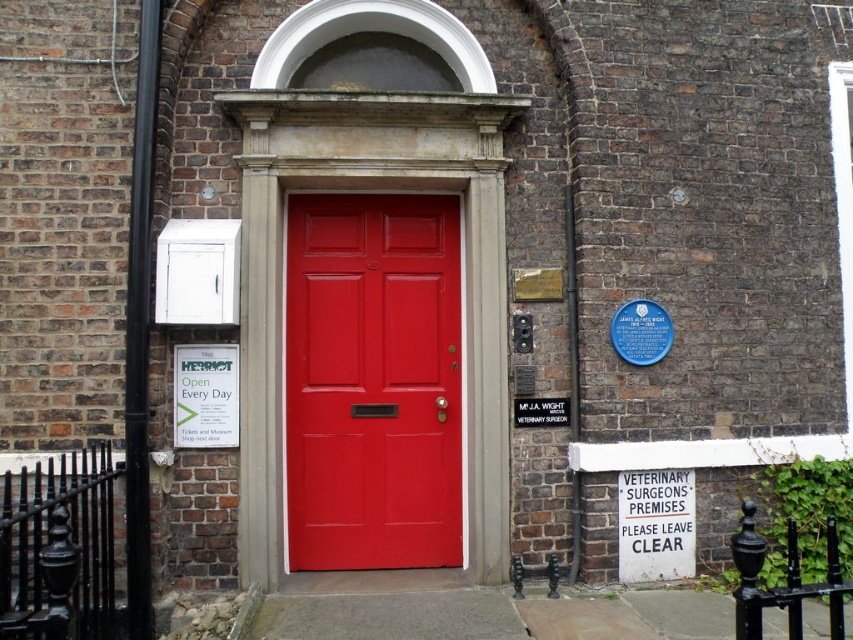
From the picture: You are a delivery person trying to deliver a package to Herriot. You see the matte red door at center and the white paper sign at center. Which object should you interact with to deliver the package?

You should interact with the matte red door at center because it is larger in size than the white paper sign at center, indicating it is the entrance for deliveries.

You are a delivery person approaching the entrance of Herriot. You need to read the sign to confirm the address. Can you see the white paper sign at center from your current position in front of the matte red door at center?

The white paper sign at center is behind matte red door at center, so you cannot see it from your current position in front of the matte red door at center.

You are a delivery person trying to deliver a package to the building. The instructions say to place it on the object that is taller between the matte red door at center and the white paper sign at center. Which object should you place the package on?

The matte red door at center is taller than the white paper sign at center, so you should place the package on the matte red door at center.